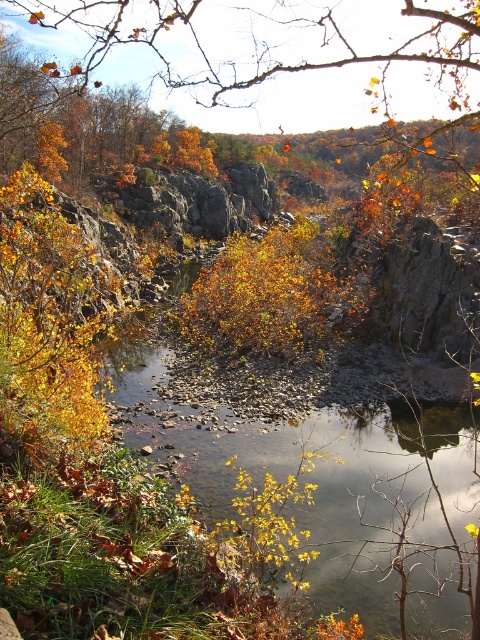
Who is lower down, smooth rock river at center or orange leafy branch at upper center?

smooth rock river at center is below.

Is smooth rock river at center taller than orange leafy branch at upper center?

Incorrect, smooth rock river at center's height is not larger of orange leafy branch at upper center's.

Which is in front, point (448, 467) or point (337, 3)?

Positioned in front is point (448, 467).

Locate an element on the screen. smooth rock river at center is located at coordinates (327, 483).